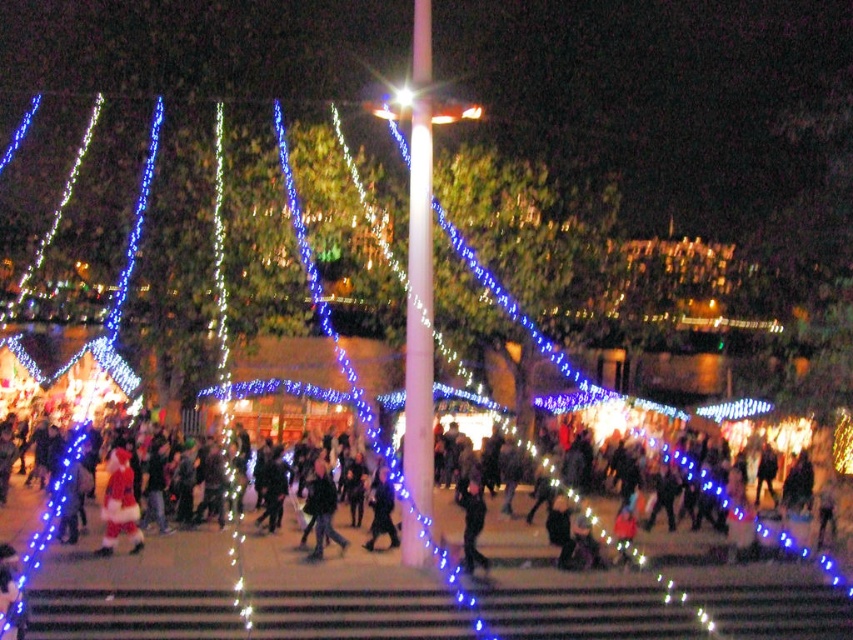
Question: Observing the image, what is the correct spatial positioning of fuzzy red santa at center in reference to dark gray jacket at center?

Choices:
 (A) below
 (B) above

Answer: (B)

Question: Can you confirm if fuzzy red santa at center is positioned above dark gray jacket at center?

Choices:
 (A) yes
 (B) no

Answer: (A)

Question: Which is nearer to the dark clothing crowd at center?

Choices:
 (A) dark gray jacket at center
 (B) dark blue jeans at center

Answer: (A)

Question: Which object is positioned farthest from the fuzzy red santa at center?

Choices:
 (A) dark clothing crowd at center
 (B) dark gray jacket at center

Answer: (A)

Question: Based on their relative distances, which object is nearer to the dark blue jeans at center?

Choices:
 (A) fuzzy red santa at center
 (B) dark clothing crowd at center

Answer: (B)

Question: Can you confirm if dark clothing crowd at center is thinner than fuzzy red santa at center?

Choices:
 (A) no
 (B) yes

Answer: (A)